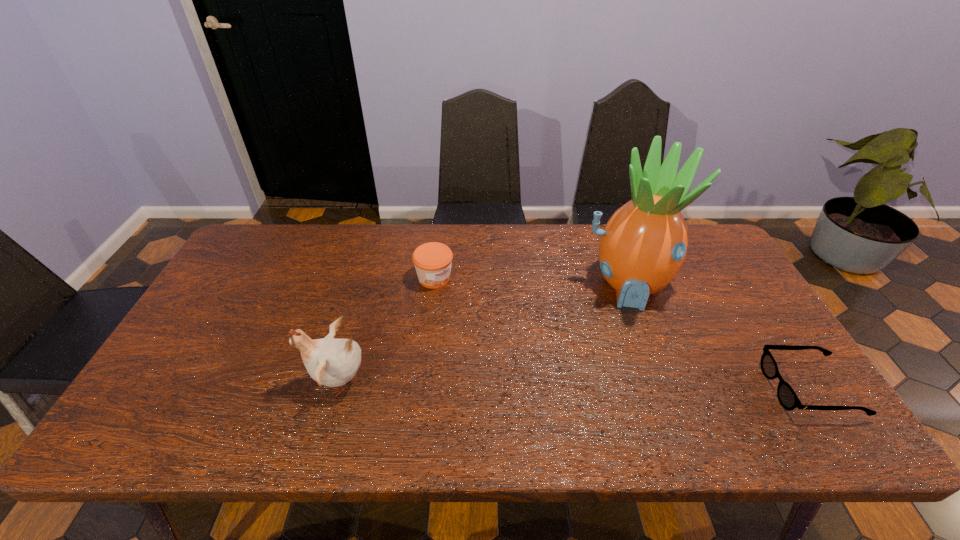
Where is `blank space located at the beak of the third shortest object`? Image resolution: width=960 pixels, height=540 pixels. blank space located at the beak of the third shortest object is located at coordinates (191, 381).

Where is `free space located 0.100m on the arms of the spectacles`? free space located 0.100m on the arms of the spectacles is located at coordinates (730, 388).

Where is `vacant space located on the arms of the spectacles`? Image resolution: width=960 pixels, height=540 pixels. vacant space located on the arms of the spectacles is located at coordinates (643, 388).

The image size is (960, 540). What are the coordinates of `blank area located 0.400m on the arms of the spectacles` in the screenshot? It's located at (606, 388).

Image resolution: width=960 pixels, height=540 pixels. What are the coordinates of `vacant position located 0.160m on the front label of the second object from left to right` in the screenshot? It's located at (485, 316).

You are a GUI agent. You are given a task and a screenshot of the screen. Output one action in this format:
    pyautogui.click(x=<x>, y=<y>)
    Task: Click on the free location located 0.230m on the front label of the second object from left to right
    
    Given the screenshot: What is the action you would take?
    pyautogui.click(x=502, y=330)

Locate an element on the screen. This screenshot has height=540, width=960. vacant region located on the front label of the second object from left to right is located at coordinates (485, 316).

Locate an element on the screen. free space located at the entrance of the tallest object is located at coordinates (632, 336).

The width and height of the screenshot is (960, 540). I want to click on blank space located at the entrance of the tallest object, so click(x=632, y=345).

Locate an element on the screen. This screenshot has width=960, height=540. vacant point located at the entrance of the tallest object is located at coordinates (636, 386).